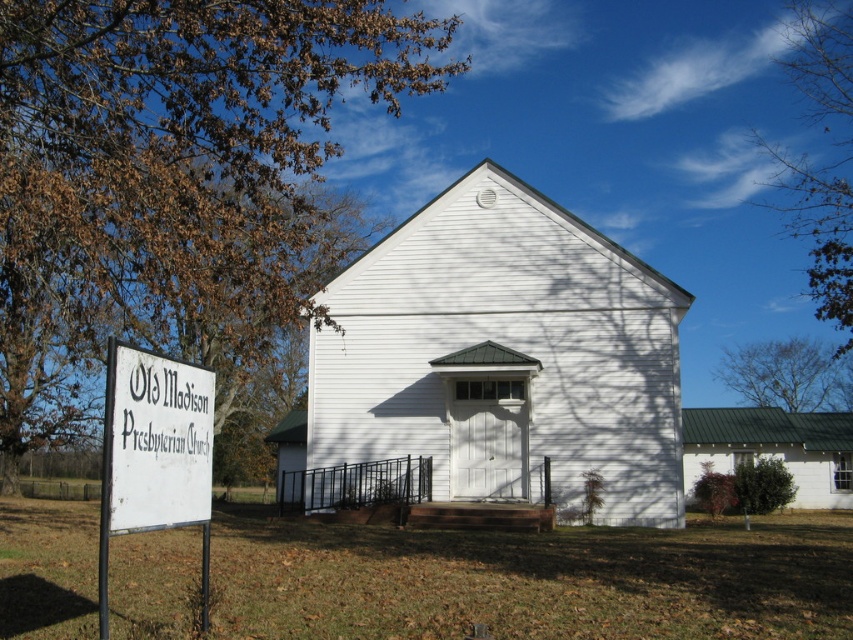
Can you confirm if white wood chapel at center is smaller than bare branches at upper right?

No.

Which of these two, white wood chapel at center or bare branches at upper right, stands shorter?

Standing shorter between the two is bare branches at upper right.

Does point (508, 182) come closer to viewer compared to point (724, 364)?

Yes, it is in front of point (724, 364).

Identify the location of white wood chapel at center. This screenshot has width=853, height=640. (503, 356).

Image resolution: width=853 pixels, height=640 pixels. What are the coordinates of `white wood chapel at center` in the screenshot? It's located at (503, 356).

What do you see at coordinates (503, 356) in the screenshot?
I see `white wood chapel at center` at bounding box center [503, 356].

Where is `white wood chapel at center`? This screenshot has width=853, height=640. white wood chapel at center is located at coordinates (503, 356).

Which is behind, point (639, 364) or point (165, 499)?

The point (639, 364) is more distant.

Can you confirm if white wood chapel at center is smaller than white wooden sign at left?

Actually, white wood chapel at center might be larger than white wooden sign at left.

Does point (436, 458) come farther from viewer compared to point (199, 404)?

Yes, it is behind point (199, 404).

Identify the location of white wood chapel at center. (503, 356).